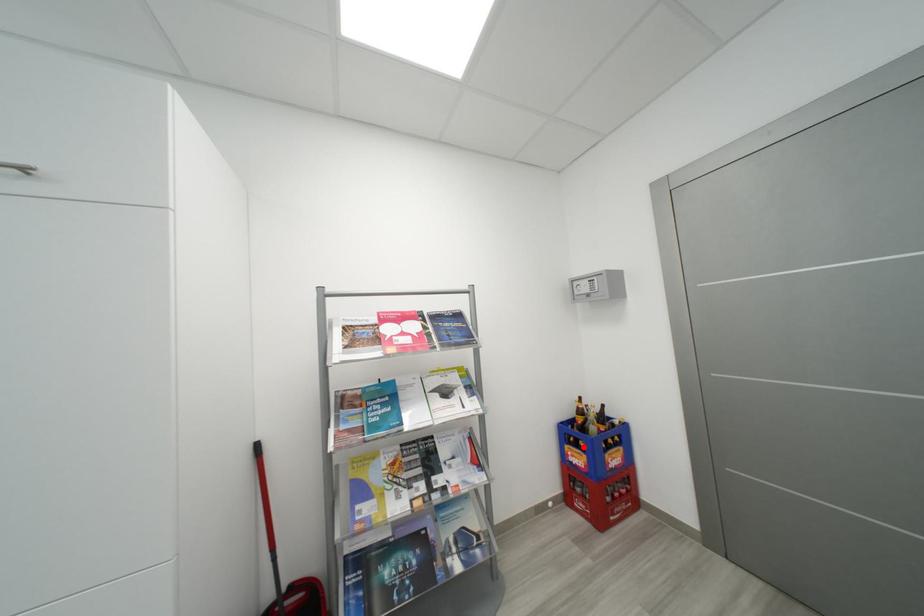
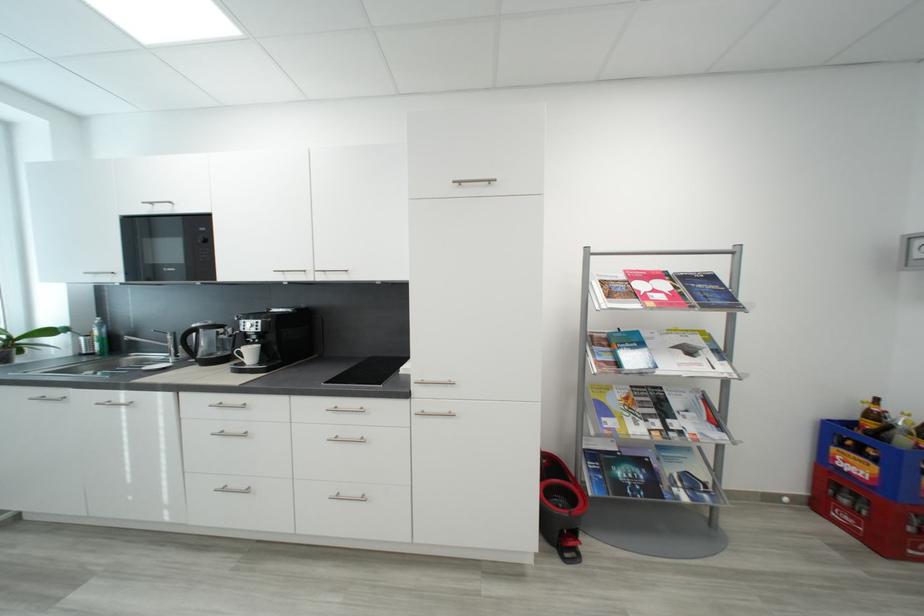
In the second image, find the point that corresponds to the highlighted location in the first image.

(867, 454)